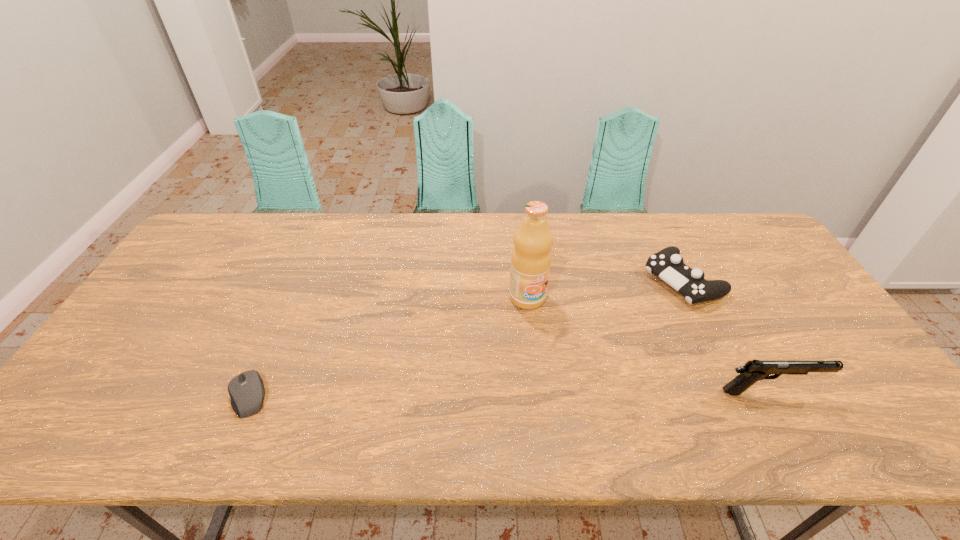
Where is `vacant region between the gun and the control`? The width and height of the screenshot is (960, 540). vacant region between the gun and the control is located at coordinates (726, 336).

Where is `empty location between the second object from left to right and the third tallest object`? This screenshot has width=960, height=540. empty location between the second object from left to right and the third tallest object is located at coordinates (605, 289).

This screenshot has height=540, width=960. In order to click on free area in between the second object from left to right and the gun in this screenshot , I will do `click(648, 345)`.

Where is `vacant area between the fruit juice and the shortest object`? This screenshot has height=540, width=960. vacant area between the fruit juice and the shortest object is located at coordinates (388, 347).

The height and width of the screenshot is (540, 960). In order to click on vacant region between the fruit juice and the gun in this screenshot , I will do [648, 345].

This screenshot has height=540, width=960. Identify the location of free point between the third object from right to left and the control. (605, 289).

The height and width of the screenshot is (540, 960). What are the coordinates of `free spot between the gun and the second shortest object` in the screenshot? It's located at (726, 336).

Locate which object is the second closest to the fruit juice. Please provide its 2D coordinates. Your answer should be formatted as a tuple, i.e. [(x, y)], where the tuple contains the x and y coordinates of a point satisfying the conditions above.

[(754, 370)]

Where is `the third closest object to the fruit juice`? The height and width of the screenshot is (540, 960). the third closest object to the fruit juice is located at coordinates (246, 390).

Identify the location of free space that satisfies the following two spatial constraints: 1. on the back side of the fruit juice; 2. on the right side of the third tallest object. (525, 280).